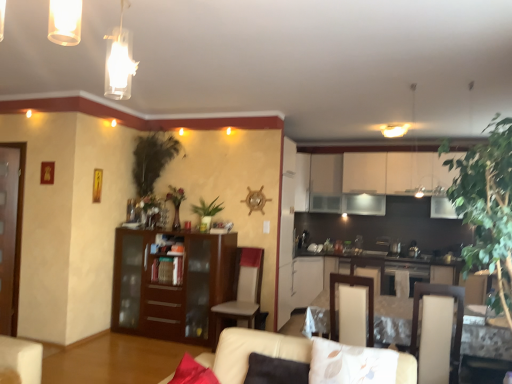
Describe the element at coordinates (152, 159) in the screenshot. The width and height of the screenshot is (512, 384). I see `green leafy plant at upper left, positioned as the first plant in back-to-front order` at that location.

Find the location of a particular element. This screenshot has height=384, width=512. light gray fabric chair at center is located at coordinates (243, 293).

Identify the location of green leafy plant at right, placed as the third plant when sorted from left to right. The image size is (512, 384). (488, 207).

Locate an element on the screen. beige leather couch at lower center is located at coordinates (251, 351).

At what (x,y) coordinates should I click in order to perform the action: click on green leafy plant at upper left, the 1th plant positioned from the left. Please return your answer as a coordinate pair (x, y). The width and height of the screenshot is (512, 384). Looking at the image, I should click on (152, 159).

From the picture: Is green leafy plant at upper left, arranged as the third plant when viewed from the right, closer to the viewer compared to dark brown wood cabinet at center?

No, the depth of green leafy plant at upper left, arranged as the third plant when viewed from the right, is greater than that of dark brown wood cabinet at center.

Would you say green leafy plant at upper left, which is counted as the third plant, starting from the front, is to the left or to the right of dark brown wood cabinet at center in the picture?

Based on their positions, green leafy plant at upper left, which is counted as the third plant, starting from the front, is located to the left of dark brown wood cabinet at center.

Looking at this image, from the image's perspective, which one is positioned lower, green leafy plant at upper left, positioned as the first plant in back-to-front order, or dark brown wood cabinet at center?

dark brown wood cabinet at center appears lower in the image.

How many degrees apart are the facing directions of white glossy table at lower right and black stainless steel oven at center?

They differ by 90.2 degrees in their facing directions.

Considering the relative positions of white glossy table at lower right and black stainless steel oven at center in the image provided, is white glossy table at lower right to the left or to the right of black stainless steel oven at center?

Based on their positions, white glossy table at lower right is located to the left of black stainless steel oven at center.

The width and height of the screenshot is (512, 384). What are the coordinates of `table that is on the left side of black stainless steel oven at center` in the screenshot? It's located at (393, 320).

Are white glossy table at lower right and black stainless steel oven at center making contact?

No, white glossy table at lower right is not touching black stainless steel oven at center.

Is green leafy plant at upper left, the 1th plant positioned from the left, situated inside beige leather armchair at center or outside?

green leafy plant at upper left, the 1th plant positioned from the left, cannot be found inside beige leather armchair at center.

From the beige leather armchair at center, count 2nd plants backward and point to it. Please provide its 2D coordinates.

[(152, 159)]

Between green leafy plant at upper left, the 1th plant positioned from the left, and beige leather armchair at center, which one appears on the left side from the viewer's perspective?

From the viewer's perspective, green leafy plant at upper left, the 1th plant positioned from the left, appears more on the left side.

Is green leafy plant at upper left, arranged as the third plant when viewed from the right, wider or thinner than beige leather armchair at center?

Clearly, green leafy plant at upper left, arranged as the third plant when viewed from the right, has less width compared to beige leather armchair at center.

Between green leafy plant at upper left, which is counted as the third plant, starting from the front, and green leafy plant at right, the 1th plant from the right, which one appears on the right side from the viewer's perspective?

Positioned to the right is green leafy plant at right, the 1th plant from the right.

What's the angular difference between green leafy plant at upper left, the 1th plant positioned from the left, and green leafy plant at right, acting as the 1th plant starting from the front,'s facing directions?

There is a 87.6-degree angle between the facing directions of green leafy plant at upper left, the 1th plant positioned from the left, and green leafy plant at right, acting as the 1th plant starting from the front.

Is green leafy plant at right, acting as the 1th plant starting from the front, inside green leafy plant at upper left, which is counted as the third plant, starting from the front?

No, green leafy plant at right, acting as the 1th plant starting from the front, is not a part of green leafy plant at upper left, which is counted as the third plant, starting from the front.

Is floral fabric pillow at center wider than light gray fabric chair at center?

In fact, floral fabric pillow at center might be narrower than light gray fabric chair at center.

Is floral fabric pillow at center in contact with light gray fabric chair at center?

No, floral fabric pillow at center is not with light gray fabric chair at center.

Considering the points (310, 381) and (234, 301), which point is behind, point (310, 381) or point (234, 301)?

Positioned behind is point (234, 301).

Between floral fabric pillow at center and light gray fabric chair at center, which one appears on the left side from the viewer's perspective?

From the viewer's perspective, light gray fabric chair at center appears more on the left side.

In the scene shown: Between light gray fabric chair at center and dark brown wood cabinet at center, which one has smaller width?

dark brown wood cabinet at center is thinner.

Is light gray fabric chair at center far away from dark brown wood cabinet at center?

Actually, light gray fabric chair at center and dark brown wood cabinet at center are a little close together.

Considering the relative positions of light gray fabric chair at center and dark brown wood cabinet at center in the image provided, is light gray fabric chair at center to the left of dark brown wood cabinet at center from the viewer's perspective?

Incorrect, light gray fabric chair at center is not on the left side of dark brown wood cabinet at center.

Is dark brown wood cabinet at center located within light gray fabric chair at center?

No, dark brown wood cabinet at center is not surrounded by light gray fabric chair at center.

Is dark brown wood cabinet at center not close to black stainless steel oven at center?

dark brown wood cabinet at center is far away from black stainless steel oven at center.

Is dark brown wood cabinet at center facing away from black stainless steel oven at center?

That's not correct — dark brown wood cabinet at center is not looking away from black stainless steel oven at center.

Choose the correct answer: Is dark brown wood cabinet at center inside black stainless steel oven at center or outside it?

dark brown wood cabinet at center is located beyond the bounds of black stainless steel oven at center.

You are a GUI agent. You are given a task and a screenshot of the screen. Output one action in this format:
    pyautogui.click(x=<x>, y=<y>)
    Task: Click on the cabinetry in front of the green leafy plant at upper left, which is counted as the third plant, starting from the front
    The width and height of the screenshot is (512, 384).
    Given the screenshot: What is the action you would take?
    pyautogui.click(x=170, y=285)

Where is `appliance above the white glossy table at lower right (from the image's perspective)`? The image size is (512, 384). appliance above the white glossy table at lower right (from the image's perspective) is located at coordinates (409, 275).

Estimate the real-world distances between objects in this image. Which object is closer to beige leather armchair at center, white glossy table at lower right or floral fabric pillow at center?

white glossy table at lower right is positioned closer to the anchor beige leather armchair at center.

Estimate the real-world distances between objects in this image. Which object is closer to green leafy plant at center, the 2th plant viewed from the right, black stainless steel oven at center or dark brown wood cabinet at center?

dark brown wood cabinet at center is closer to green leafy plant at center, the 2th plant viewed from the right.

Looking at the image, which one is located closer to green leafy plant at right, acting as the 1th plant starting from the front, white glossy table at lower right or beige leather armchair at center?

Based on the image, beige leather armchair at center appears to be nearer to green leafy plant at right, acting as the 1th plant starting from the front.

Looking at this image, considering their positions, is dark brown wood cabinet at center positioned closer to green leafy plant at center, the 2th plant viewed from the right, than white glossy light fixture at upper center?

Among the two, dark brown wood cabinet at center is located nearer to green leafy plant at center, the 2th plant viewed from the right.

Considering their positions, is green leafy plant at right, placed as the third plant when sorted from back to front, positioned further to green leafy plant at upper left, positioned as the first plant in back-to-front order, than beige leather armchair at center?

Among the two, green leafy plant at right, placed as the third plant when sorted from back to front, is located further to green leafy plant at upper left, positioned as the first plant in back-to-front order.

Estimate the real-world distances between objects in this image. Which object is further from black stainless steel oven at center, dark brown wood cabinet at center or green leafy plant at center, which ranks as the 2th plant in front-to-back order?

Among the two, dark brown wood cabinet at center is located further to black stainless steel oven at center.

When comparing their distances from green leafy plant at upper left, positioned as the first plant in back-to-front order, does black stainless steel oven at center or beige leather couch at lower center seem further?

beige leather couch at lower center is further to green leafy plant at upper left, positioned as the first plant in back-to-front order.

Looking at the image, which one is located further to light gray fabric chair at center, dark brown wood cabinet at center or black stainless steel oven at center?

black stainless steel oven at center lies further to light gray fabric chair at center than the other object.

Where is `cabinetry between floral fabric pillow at center and black stainless steel oven at center from front to back`? cabinetry between floral fabric pillow at center and black stainless steel oven at center from front to back is located at coordinates (170, 285).

Where is `chair positioned between white glossy table at lower right and white glossy light fixture at upper center from near to far`? The image size is (512, 384). chair positioned between white glossy table at lower right and white glossy light fixture at upper center from near to far is located at coordinates (243, 293).

Where is `chair between green leafy plant at upper left, the 1th plant positioned from the left, and white glossy table at lower right, in the horizontal direction`? chair between green leafy plant at upper left, the 1th plant positioned from the left, and white glossy table at lower right, in the horizontal direction is located at coordinates (243, 293).

Where is `table between beige leather couch at lower center and dark brown wood cabinet at center along the z-axis`? This screenshot has width=512, height=384. table between beige leather couch at lower center and dark brown wood cabinet at center along the z-axis is located at coordinates (393, 320).